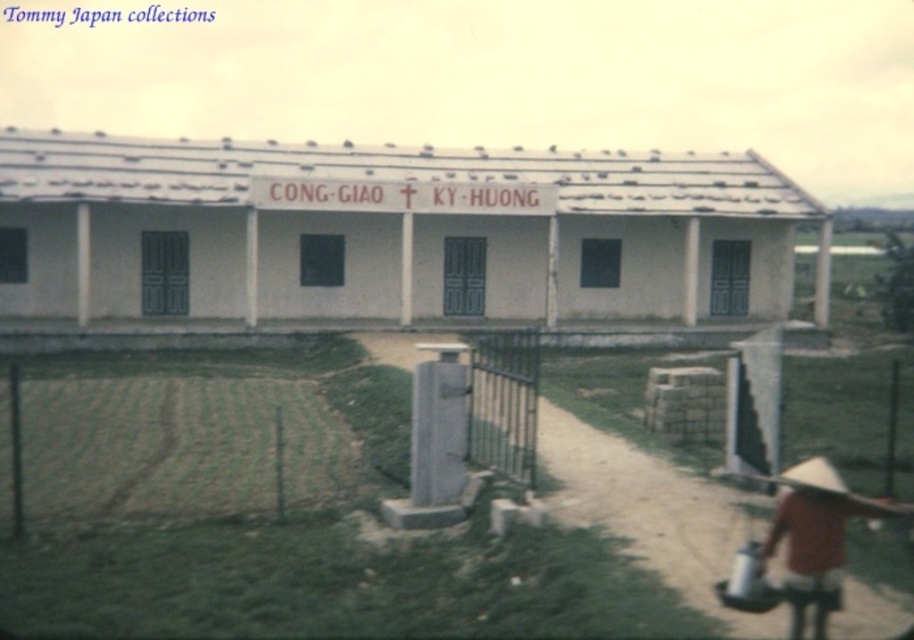
Question: Which of the following is the farthest from the observer?

Choices:
 (A) (819, 586)
 (B) (486, 349)
 (C) (812, 486)
 (D) (464, 372)

Answer: (D)

Question: Which point appears closest to the camera in this image?

Choices:
 (A) (461, 417)
 (B) (838, 506)
 (C) (496, 337)
 (D) (815, 486)

Answer: (D)

Question: Is metallic silver gate at center positioned in front of gray concrete pillar at center?

Choices:
 (A) no
 (B) yes

Answer: (B)

Question: Which of the following is the closest to the observer?

Choices:
 (A) metallic silver gate at center
 (B) gray concrete pillar at center
 (C) brown straw hat at lower right

Answer: (C)

Question: Is metallic silver gate at center to the right of white straw hat at lower right from the viewer's perspective?

Choices:
 (A) yes
 (B) no

Answer: (B)

Question: Is brown straw hat at lower right positioned before metallic silver gate at center?

Choices:
 (A) no
 (B) yes

Answer: (B)